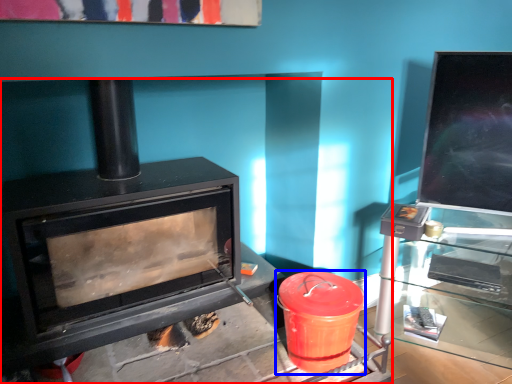
Question: Which of the following is the closest to the observer, wood burning stove (highlighted by a red box) or crock pot (highlighted by a blue box)?

Choices:
 (A) wood burning stove
 (B) crock pot

Answer: (A)